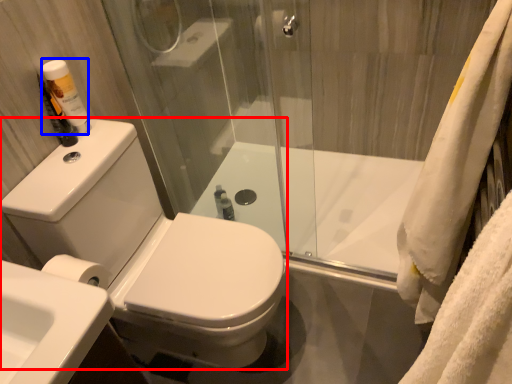
Question: Which object is closer to the camera taking this photo, porcelain (highlighted by a red box) or toiletry (highlighted by a blue box)?

Choices:
 (A) porcelain
 (B) toiletry

Answer: (A)